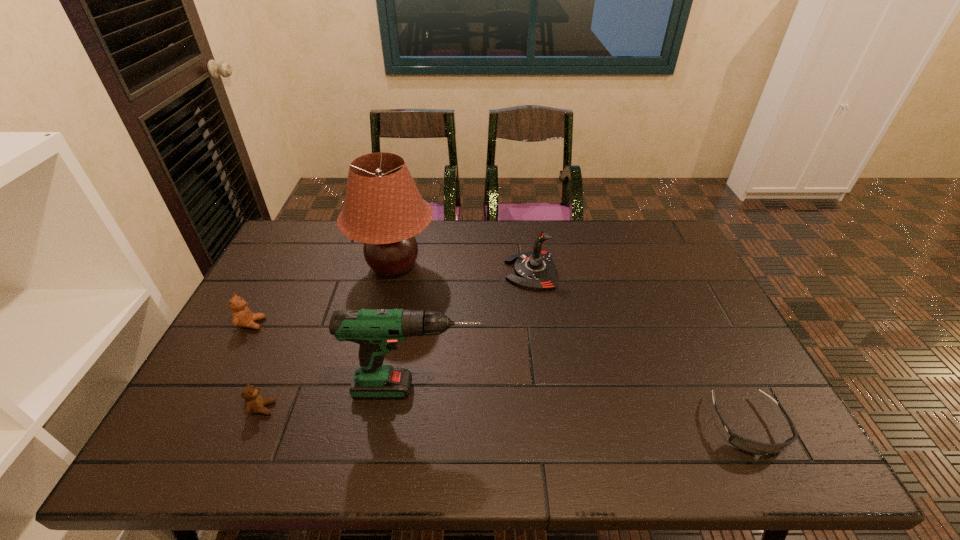
Find the location of `free space located 0.090m on the front-facing side of the tallest object`. free space located 0.090m on the front-facing side of the tallest object is located at coordinates (465, 266).

At what (x,y) coordinates should I click in order to perform the action: click on free location located on the handle side of the second tallest object. Please return your answer as a coordinate pair (x, y). Looking at the image, I should click on (631, 389).

Locate an element on the screen. free space located 0.310m on the handle side of the third tallest object is located at coordinates (409, 271).

The image size is (960, 540). Find the location of `vacant space positioned on the handle side of the third tallest object`. vacant space positioned on the handle side of the third tallest object is located at coordinates (415, 271).

The height and width of the screenshot is (540, 960). Identify the location of blank space located 0.250m on the handle side of the third tallest object. pos(427,271).

The width and height of the screenshot is (960, 540). Find the location of `free space located on the face of the fourth nearest object`. free space located on the face of the fourth nearest object is located at coordinates (338, 323).

Where is `vacant region located at the face of the shorter teddy bear`? vacant region located at the face of the shorter teddy bear is located at coordinates (333, 408).

Locate an element on the screen. The width and height of the screenshot is (960, 540). lampshade that is at the far edge is located at coordinates (383, 209).

The height and width of the screenshot is (540, 960). What are the coordinates of `joystick that is at the far edge` in the screenshot? It's located at (535, 270).

Where is `object at the near edge`? object at the near edge is located at coordinates (749, 446).